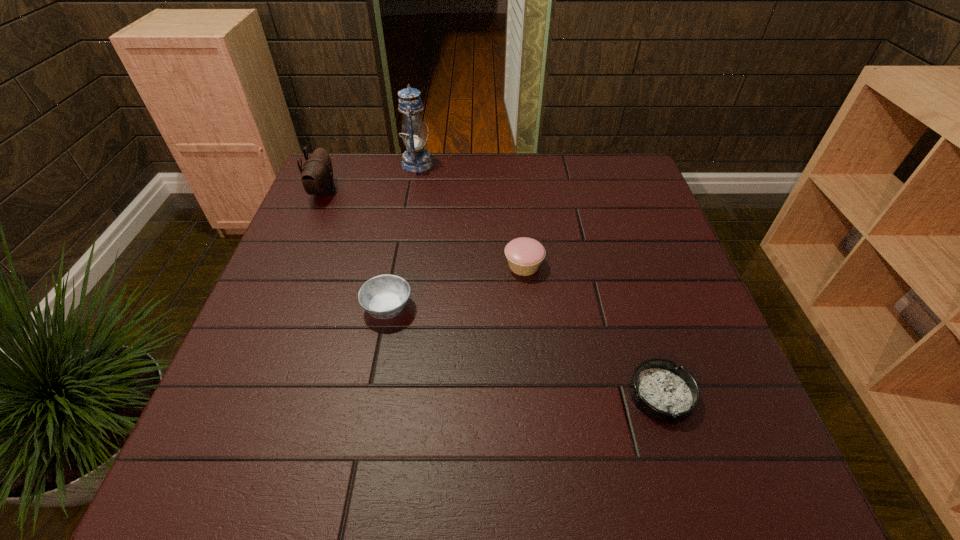
At what (x,y) coordinates should I click in order to perform the action: click on free spot between the fourth farthest object and the leftmost object. Please return your answer as a coordinate pair (x, y). Looking at the image, I should click on (355, 249).

Where is `free area in between the second object from right to left and the fourth shortest object`? This screenshot has height=540, width=960. free area in between the second object from right to left and the fourth shortest object is located at coordinates (423, 229).

Find the location of `empty space that is in between the cupcake and the pouch`. empty space that is in between the cupcake and the pouch is located at coordinates (423, 229).

Find the location of a particular element. The height and width of the screenshot is (540, 960). free space between the cupcake and the fourth shortest object is located at coordinates (423, 229).

You are a GUI agent. You are given a task and a screenshot of the screen. Output one action in this format:
    pyautogui.click(x=<x>, y=<y>)
    Task: Click on the empty location between the left ashtray and the farthest object
    The height and width of the screenshot is (540, 960).
    Given the screenshot: What is the action you would take?
    pyautogui.click(x=402, y=235)

Image resolution: width=960 pixels, height=540 pixels. In order to click on empty space between the shorter ashtray and the farther ashtray in this screenshot , I will do `click(524, 351)`.

You are a GUI agent. You are given a task and a screenshot of the screen. Output one action in this format:
    pyautogui.click(x=<x>, y=<y>)
    Task: Click on the closest object to the lantern
    
    Given the screenshot: What is the action you would take?
    pyautogui.click(x=317, y=174)

The height and width of the screenshot is (540, 960). I want to click on object that is the fourth closest to the third nearest object, so click(317, 174).

I want to click on free location that satisfies the following two spatial constraints: 1. on the front-facing side of the tallest object; 2. on the back side of the third shortest object, so click(x=398, y=266).

What are the coordinates of `blank space that satisfies the following two spatial constraints: 1. on the back side of the rightmost object; 2. with the flap open on the leftmost object` in the screenshot? It's located at (597, 192).